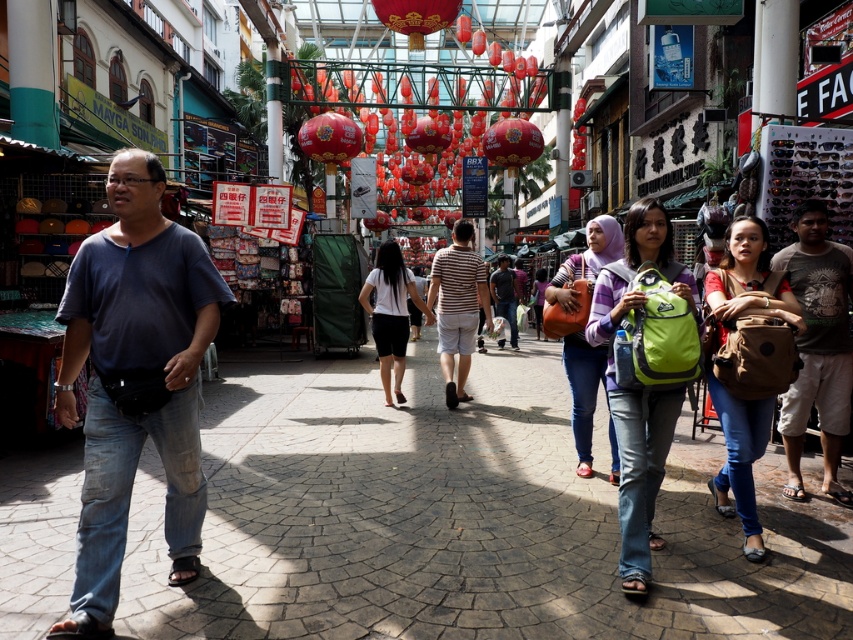
You are a tailor comparing the sizes of two shirts in the scene. The shirts are the dark blue cotton shirt at left and the striped cotton shirt at center. Which shirt has a narrower width?

The dark blue cotton shirt at left has a narrower width than the striped cotton shirt at center.

You are a delivery person who needs to place a small package on the ground. You see the paved stone at center and the white matte skirt at center. Which surface has enough space to place the package without overlapping?

The white matte skirt at center has a greater width than the paved stone at center, so it provides more space to place the package without overlapping.

You are a fashion designer observing the street scene and notice two items of clothing worn by the same person. The items are the white matte skirt at center and the dark blue shirt at center. Which clothing item is positioned lower on the person?

The white matte skirt at center is positioned below the dark blue shirt at center, so it is lower on the person.